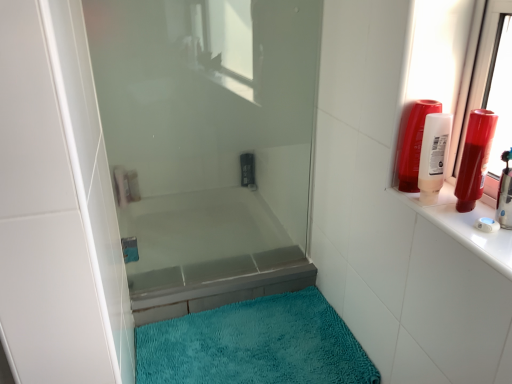
Where is `free area below teal plush bath mat at lower center (from a real-world perspective)`? free area below teal plush bath mat at lower center (from a real-world perspective) is located at coordinates (246, 348).